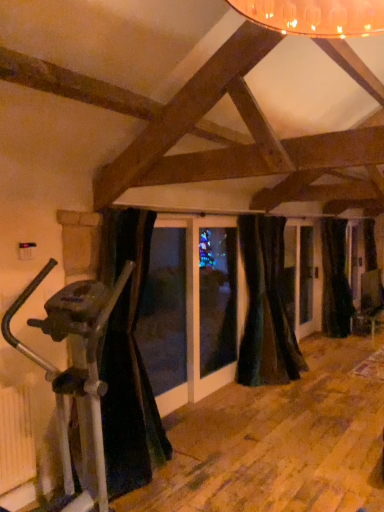
Question: From a real-world perspective, is black velvet curtain at left, marked as the 1th curtain in a front-to-back arrangement, beneath black velvet curtain at right, which is the 3th curtain from left to right?

Choices:
 (A) yes
 (B) no

Answer: (B)

Question: Does black velvet curtain at left, the 1th curtain from the left, come in front of black velvet curtain at right, the 1th curtain positioned from the back?

Choices:
 (A) yes
 (B) no

Answer: (A)

Question: Considering the relative sizes of black velvet curtain at left, the 1th curtain from the left, and black velvet curtain at right, which is the 3th curtain from left to right, in the image provided, is black velvet curtain at left, the 1th curtain from the left, smaller than black velvet curtain at right, which is the 3th curtain from left to right,?

Choices:
 (A) yes
 (B) no

Answer: (B)

Question: Does black velvet curtain at left, which appears as the third curtain when viewed from the right, lie behind black velvet curtain at right, which is the 3th curtain from left to right?

Choices:
 (A) no
 (B) yes

Answer: (A)

Question: Does black velvet curtain at left, marked as the 1th curtain in a front-to-back arrangement, have a greater width compared to black velvet curtain at right, the 1th curtain positioned from the back?

Choices:
 (A) yes
 (B) no

Answer: (A)

Question: Does black velvet curtain at left, which appears as the third curtain when viewed from the right, have a larger size compared to black velvet curtain at right, the 1th curtain positioned from the back?

Choices:
 (A) no
 (B) yes

Answer: (B)

Question: Is velvet dark green curtain at center, the 2th curtain when ordered from front to back, smaller than silver metallic stationary bicycle at left?

Choices:
 (A) no
 (B) yes

Answer: (B)

Question: Is velvet dark green curtain at center, positioned as the 2th curtain in right-to-left order, thinner than silver metallic stationary bicycle at left?

Choices:
 (A) yes
 (B) no

Answer: (A)

Question: Is velvet dark green curtain at center, the second curtain from the back, positioned far away from silver metallic stationary bicycle at left?

Choices:
 (A) yes
 (B) no

Answer: (A)

Question: Can we say velvet dark green curtain at center, positioned as the 2th curtain in right-to-left order, lies outside silver metallic stationary bicycle at left?

Choices:
 (A) yes
 (B) no

Answer: (A)

Question: Is velvet dark green curtain at center, positioned as the 2th curtain in right-to-left order, to the left of silver metallic stationary bicycle at left from the viewer's perspective?

Choices:
 (A) yes
 (B) no

Answer: (B)

Question: Is velvet dark green curtain at center, the 2th curtain when ordered from front to back, closer to the viewer compared to silver metallic stationary bicycle at left?

Choices:
 (A) yes
 (B) no

Answer: (B)

Question: From a real-world perspective, is black velvet curtain at right, the 1th curtain positioned from the back, under velvet dark green curtain at center, acting as the 2th curtain starting from the left?

Choices:
 (A) no
 (B) yes

Answer: (B)